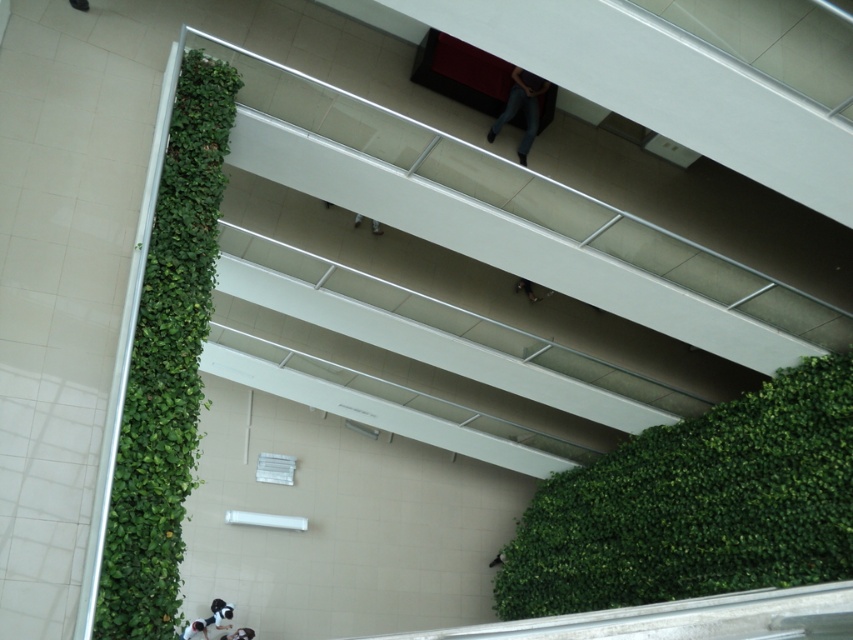
You are standing at the entrance of the atrium and want to take a photo of both the green leafy wall at lower right and the green leafy wall at left. Which wall should you position yourself closer to in order to capture both in a single frame?

You should position yourself closer to the green leafy wall at lower right because it is located below the green leafy wall at left, allowing both to be included in the frame when closer to the lower one.